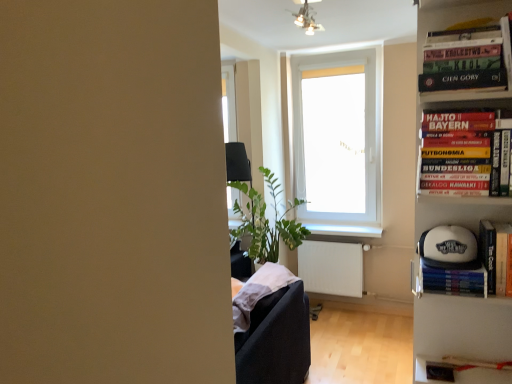
Question: Does white glossy window sill at center have a lesser width compared to hardcover book at right, which appears as the 2th book when ordered from the bottom?

Choices:
 (A) yes
 (B) no

Answer: (B)

Question: Is white glossy window sill at center not close to hardcover book at right, which appears as the 2th book when ordered from the bottom?

Choices:
 (A) yes
 (B) no

Answer: (A)

Question: From the image's perspective, is white glossy window sill at center located beneath hardcover book at right, which appears as the 2th book when ordered from the bottom?

Choices:
 (A) yes
 (B) no

Answer: (A)

Question: Is white glossy window sill at center completely or partially outside of hardcover book at right, which appears as the 2th book when ordered from the bottom?

Choices:
 (A) no
 (B) yes

Answer: (B)

Question: Is hardcover book at right, the 2th book in the top-to-bottom sequence, surrounded by white glossy window sill at center?

Choices:
 (A) yes
 (B) no

Answer: (B)

Question: From a real-world perspective, is white glossy window sill at center on top of hardcover book at right, which appears as the 2th book when ordered from the bottom?

Choices:
 (A) no
 (B) yes

Answer: (A)

Question: Is white plastic bookcase at right wider than white glossy window sill at center?

Choices:
 (A) yes
 (B) no

Answer: (B)

Question: Is white plastic bookcase at right to the right of white glossy window sill at center from the viewer's perspective?

Choices:
 (A) no
 (B) yes

Answer: (A)

Question: Does white plastic bookcase at right have a lesser width compared to white glossy window sill at center?

Choices:
 (A) yes
 (B) no

Answer: (A)

Question: Is there a large distance between white plastic bookcase at right and white glossy window sill at center?

Choices:
 (A) no
 (B) yes

Answer: (B)

Question: Can you confirm if white plastic bookcase at right is smaller than white glossy window sill at center?

Choices:
 (A) yes
 (B) no

Answer: (B)

Question: Can you see white plastic bookcase at right touching white glossy window sill at center?

Choices:
 (A) no
 (B) yes

Answer: (A)

Question: From a real-world perspective, is white matte baseball cap at right, the 1th book from the bottom, below white glossy window sill at center?

Choices:
 (A) yes
 (B) no

Answer: (B)